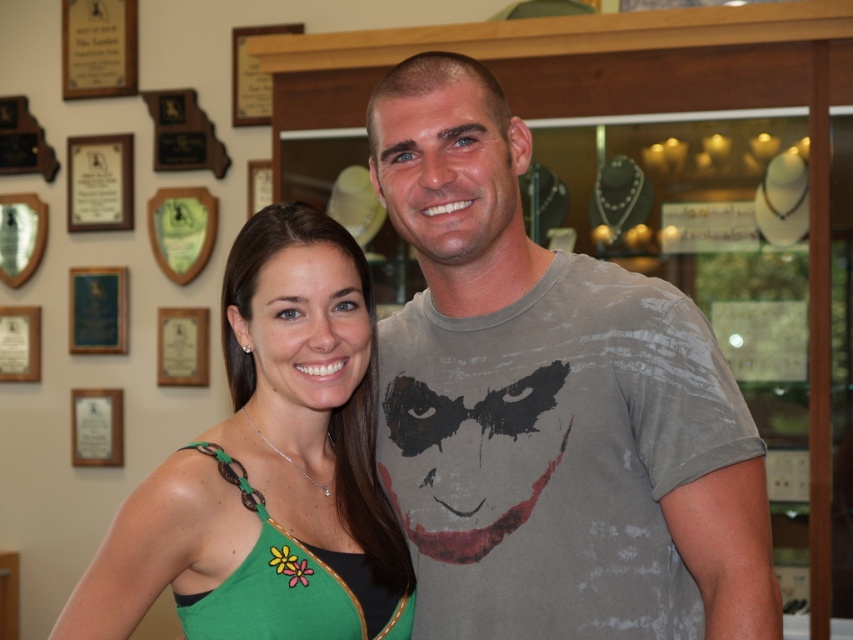
Question: Which point is closer to the camera taking this photo?

Choices:
 (A) (1, 323)
 (B) (171, 378)

Answer: (B)

Question: Which of the following is the farthest from the observer?

Choices:
 (A) wooden plaque at upper center
 (B) matte wood plaque at upper left
 (C) green fabric dress at center

Answer: (B)

Question: Is green fabric dress at center to the right of gold plaque at upper left from the viewer's perspective?

Choices:
 (A) yes
 (B) no

Answer: (A)

Question: Which point is closer to the camera?

Choices:
 (A) (123, 504)
 (B) (30, 317)
 (C) (180, 250)
 (D) (102, 392)

Answer: (A)

Question: Can you confirm if matte white plaque at lower left is wider than matte wood picture frame at upper left?

Choices:
 (A) yes
 (B) no

Answer: (A)

Question: Can you confirm if green wood plaque at upper left is positioned above green plaque at upper left?

Choices:
 (A) no
 (B) yes

Answer: (B)